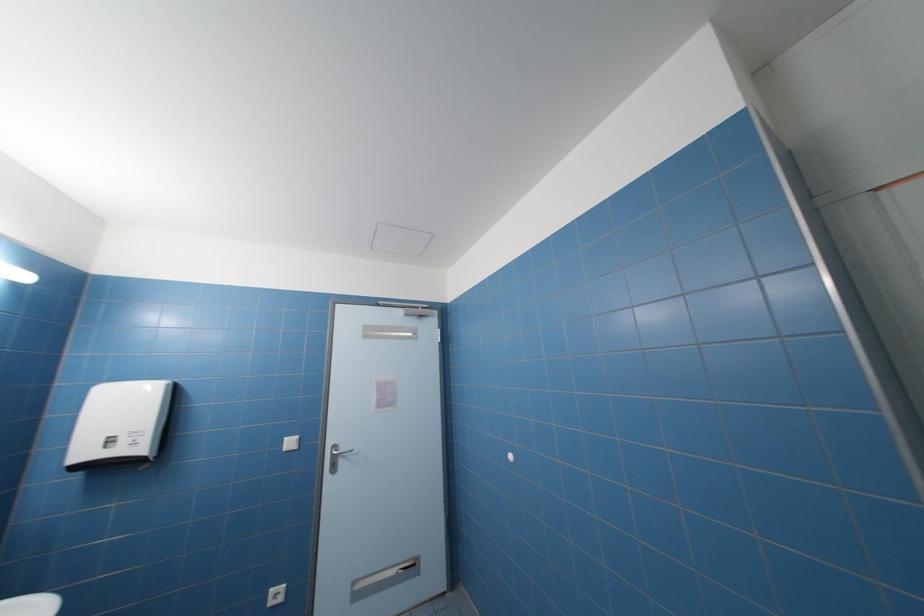
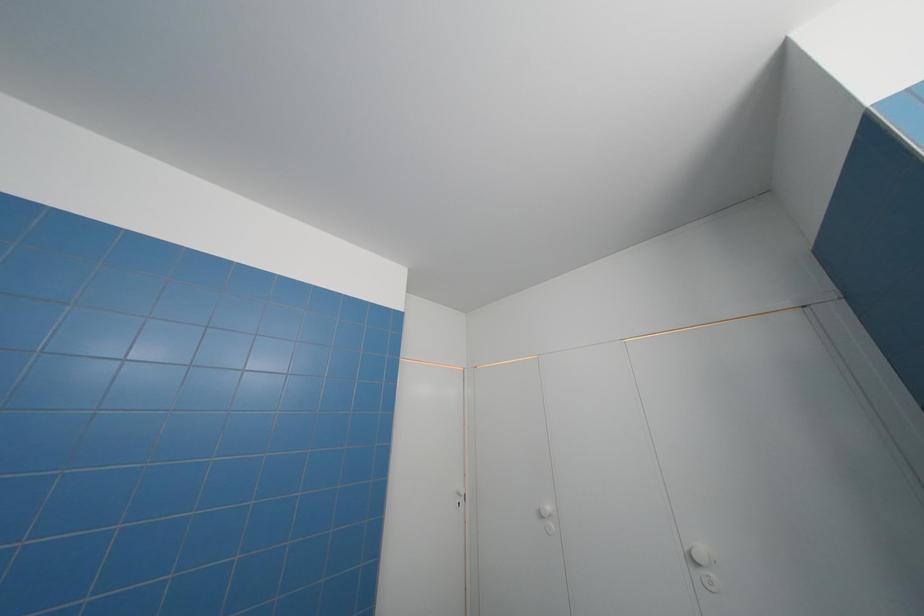
Based on the continuous images, in which direction is the camera rotating?

The camera rotated toward right-up.